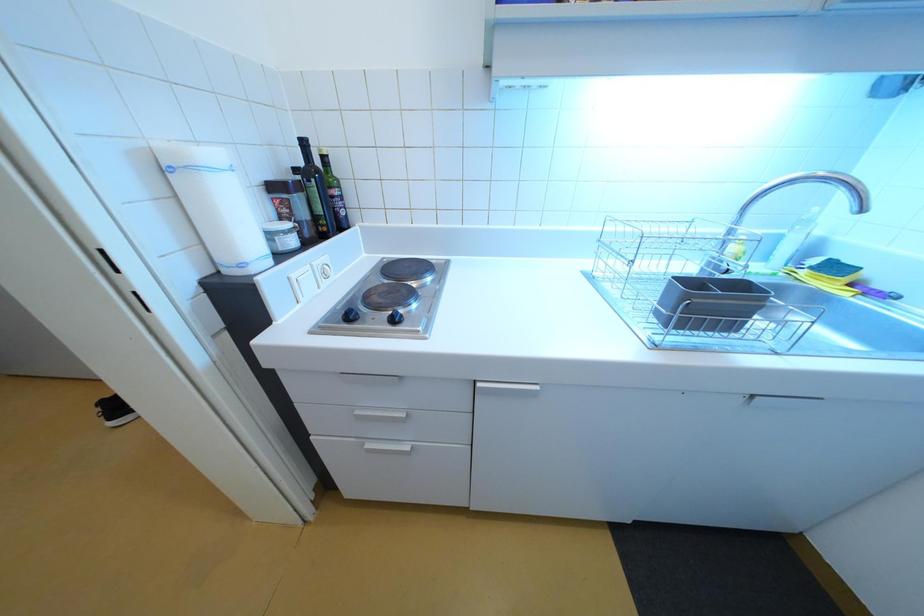
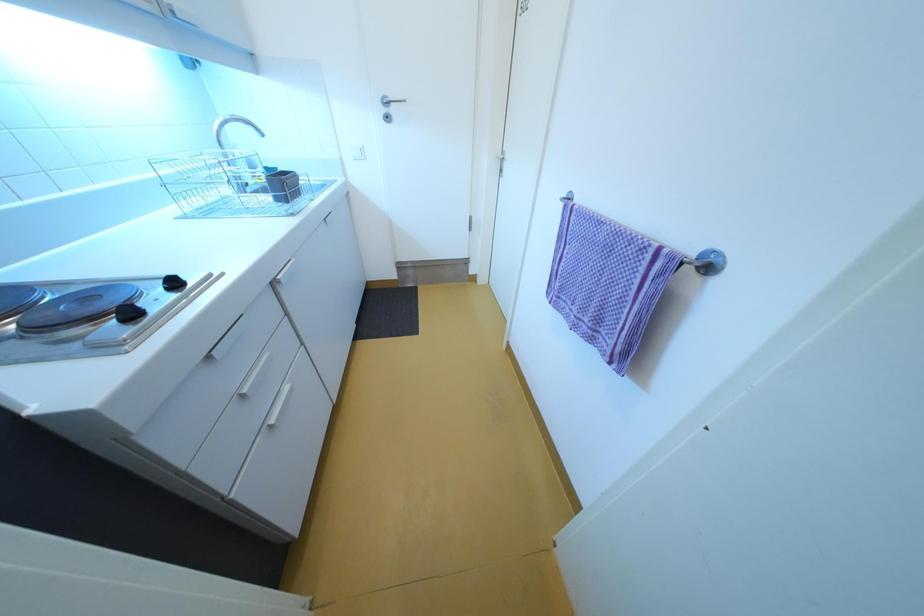
Based on the continuous images, in which direction is the camera rotating?

The rotation direction of the camera is right-down.